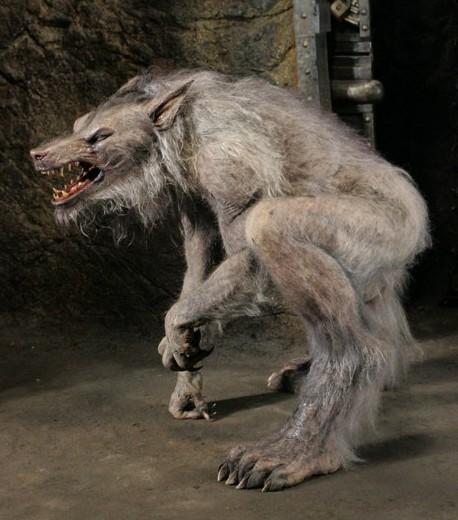
Image resolution: width=458 pixels, height=520 pixels. Find the location of `floor`. floor is located at coordinates (85, 386), (71, 492), (418, 503), (432, 353).